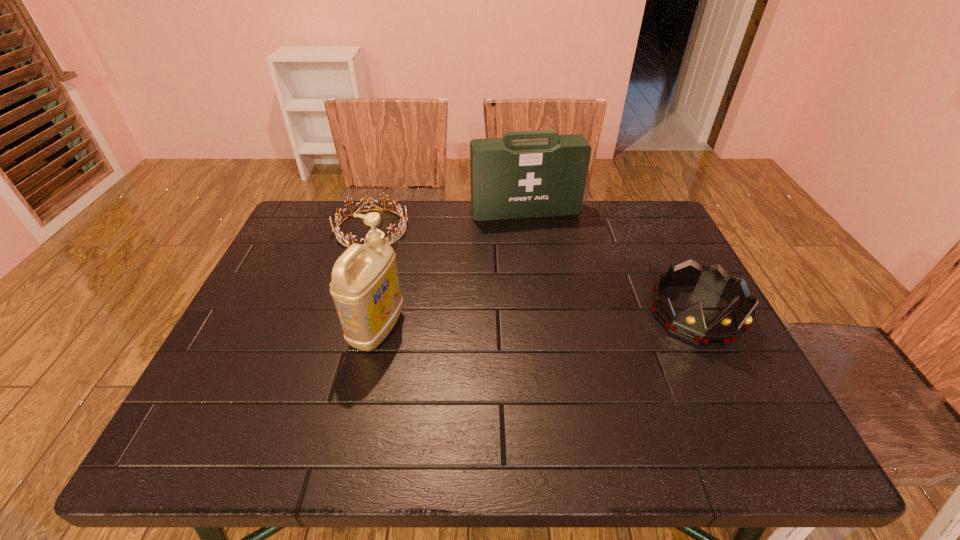
What are the coordinates of `vacant area that lies between the first-aid kit and the taller tiara` in the screenshot? It's located at (611, 262).

I want to click on empty space between the detergent and the right tiara, so click(x=537, y=321).

Find the location of a particular element. This screenshot has height=540, width=960. empty location between the left tiara and the second object from right to left is located at coordinates (448, 220).

This screenshot has height=540, width=960. Find the location of `object that is the closest to the detergent`. object that is the closest to the detergent is located at coordinates (402, 220).

Locate an element on the screen. The height and width of the screenshot is (540, 960). the second closest object relative to the left tiara is located at coordinates (365, 287).

Image resolution: width=960 pixels, height=540 pixels. Find the location of `vacant space that satisfies the following two spatial constraints: 1. on the back side of the second object from right to left; 2. on the right side of the shorter tiara`. vacant space that satisfies the following two spatial constraints: 1. on the back side of the second object from right to left; 2. on the right side of the shorter tiara is located at coordinates (377, 211).

Find the location of a particular element. The width and height of the screenshot is (960, 540). vacant space that satisfies the following two spatial constraints: 1. on the back side of the first-aid kit; 2. on the left side of the detergent is located at coordinates (404, 211).